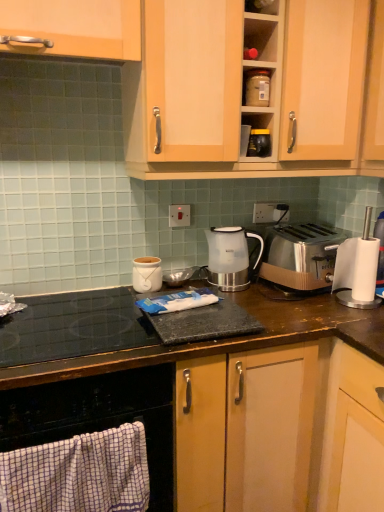
The image size is (384, 512). I want to click on free space above brown wood countertop at center (from a real-world perspective), so click(x=178, y=294).